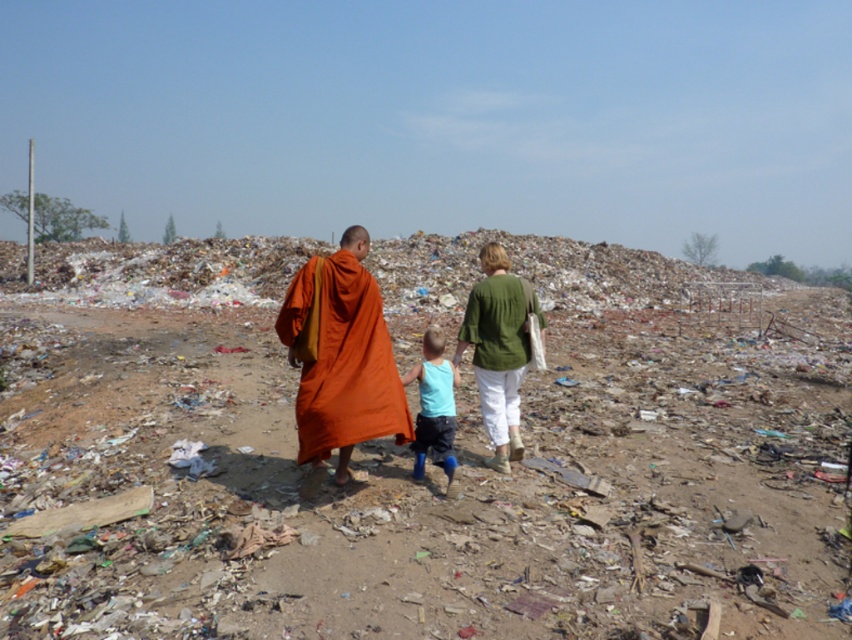
You are standing at the point marked as point (426,600). There are two people walking ahead of you. The first person is a monk in an orange robe walking with a child in a light blue sleeveless top and dark shorts, and the second person is a woman to their right. How far apart are these two people from each other?

The two people are 4.09 meters apart.

You are a photographer trying to capture a clear shot of the orange cloth robe at center and the light blue fabric shirt at center. Since the robe is above the shirt, how should you adjust your camera angle to ensure both are visible in the frame?

Since the orange cloth robe at center is above the light blue fabric shirt at center, you should angle your camera slightly upward to capture both the robe and the shirt in the frame.